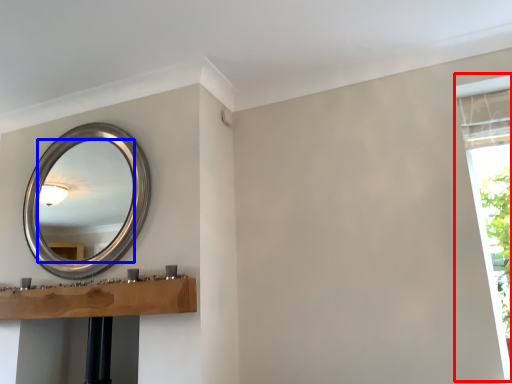
Question: Which object is further to the camera taking this photo, window frame (highlighted by a red box) or mirror (highlighted by a blue box)?

Choices:
 (A) window frame
 (B) mirror

Answer: (B)